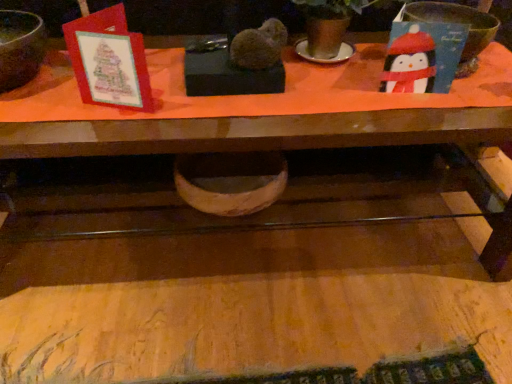
In order to click on vacant area situated below wooden table at lower center (from a real-world perspective) in this screenshot , I will do `click(263, 356)`.